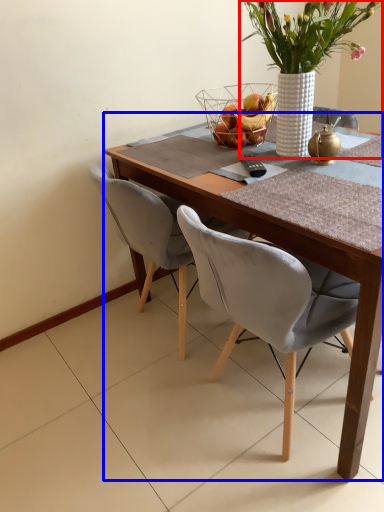
Question: Which point is closer to the camera, houseplant (highlighted by a red box) or round table (highlighted by a blue box)?

Choices:
 (A) houseplant
 (B) round table

Answer: (B)